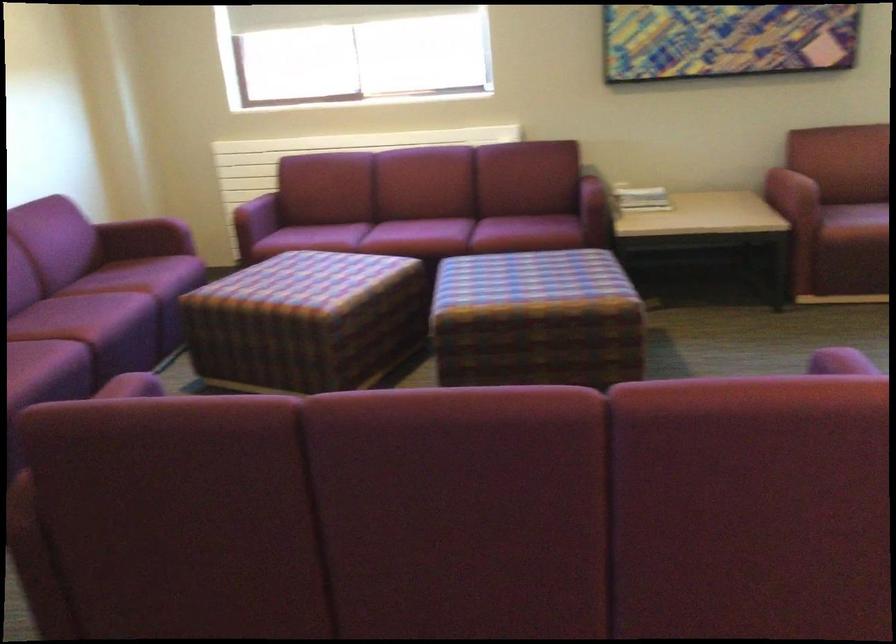
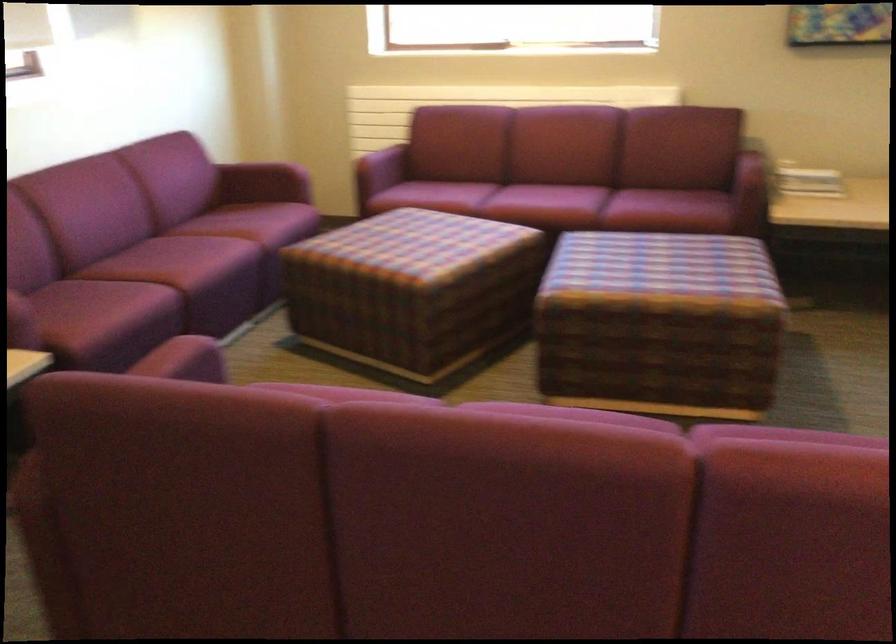
Find the pixel in the second image that matches (x=530, y=232) in the first image.

(668, 211)